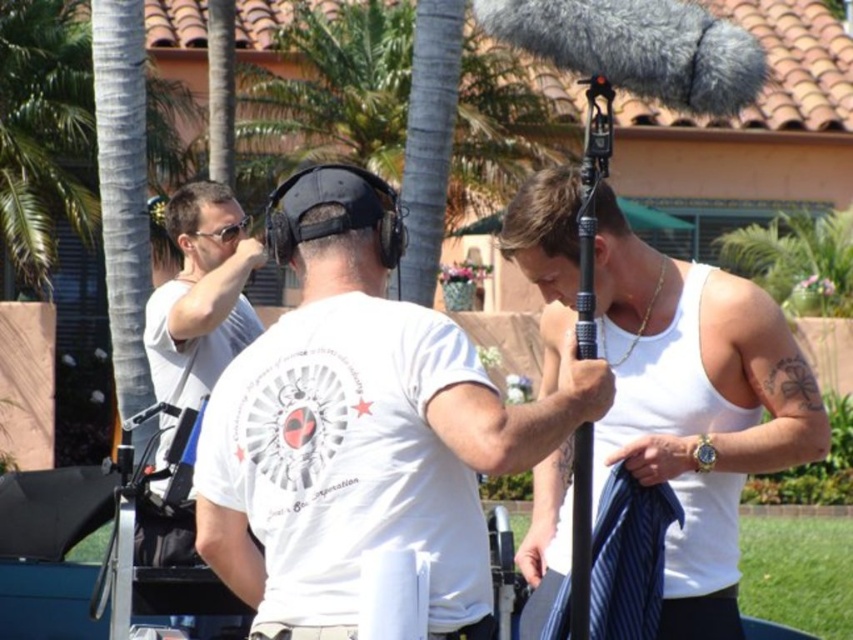
Question: Estimate the real-world distances between objects in this image. Which object is farther from the white matte shirt at left?

Choices:
 (A) black plastic goggles at upper left
 (B) white matte t-shirt at center

Answer: (B)

Question: Which of the following is the closest to the observer?

Choices:
 (A) black plastic goggles at upper left
 (B) white matte shirt at left
 (C) white tank top at center

Answer: (C)

Question: Is the position of white matte shirt at left less distant than that of black plastic goggles at upper left?

Choices:
 (A) yes
 (B) no

Answer: (A)

Question: Is white matte t-shirt at center smaller than white tank top at center?

Choices:
 (A) yes
 (B) no

Answer: (B)

Question: Which point is closer to the camera?

Choices:
 (A) white matte shirt at left
 (B) black plastic goggles at upper left
 (C) white matte t-shirt at center
 (D) white tank top at center

Answer: (C)

Question: Where is white matte t-shirt at center located in relation to white matte shirt at left in the image?

Choices:
 (A) left
 (B) right

Answer: (B)